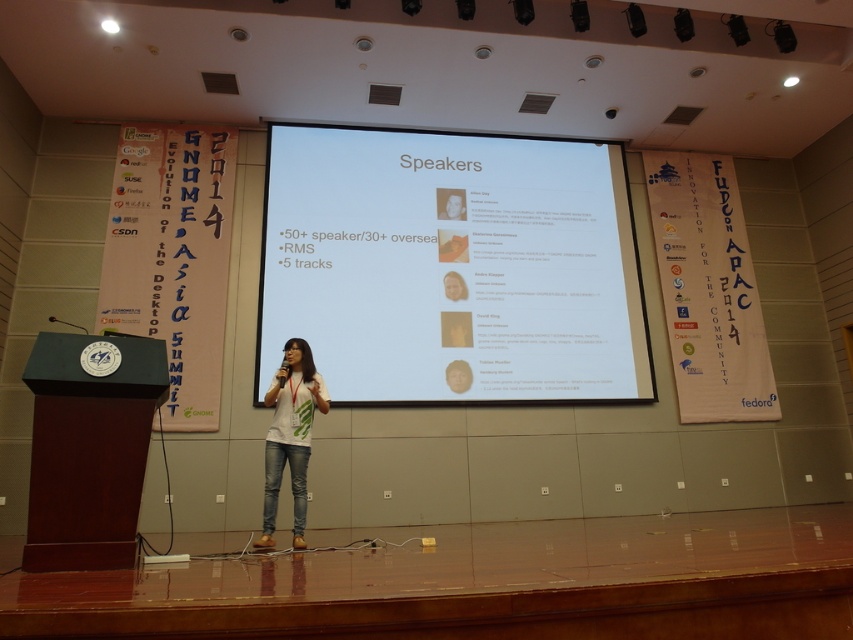
Which is more to the right, dark wood podium at left or white matte t-shirt at center?

white matte t-shirt at center

Identify the location of dark wood podium at left. (88, 448).

From the picture: Measure the distance between dark wood podium at left and camera.

3.11 meters

Find the location of `dark wood podium at left`. dark wood podium at left is located at coordinates (88, 448).

Looking at this image, can you confirm if white glossy projector screen at center is positioned below white matte t-shirt at center?

Actually, white glossy projector screen at center is above white matte t-shirt at center.

Between white glossy projector screen at center and white matte t-shirt at center, which one is positioned higher?

Positioned higher is white glossy projector screen at center.

I want to click on white glossy projector screen at center, so click(x=451, y=266).

I want to click on white glossy projector screen at center, so click(x=451, y=266).

Is white glossy projector screen at center positioned at the back of dark wood podium at left?

Yes, white glossy projector screen at center is further from the viewer.

Consider the image. Can you confirm if white glossy projector screen at center is positioned to the left of dark wood podium at left?

In fact, white glossy projector screen at center is to the right of dark wood podium at left.

Who is more distant from viewer, [340,268] or [157,346]?

Positioned behind is point [340,268].

I want to click on white glossy projector screen at center, so click(451, 266).